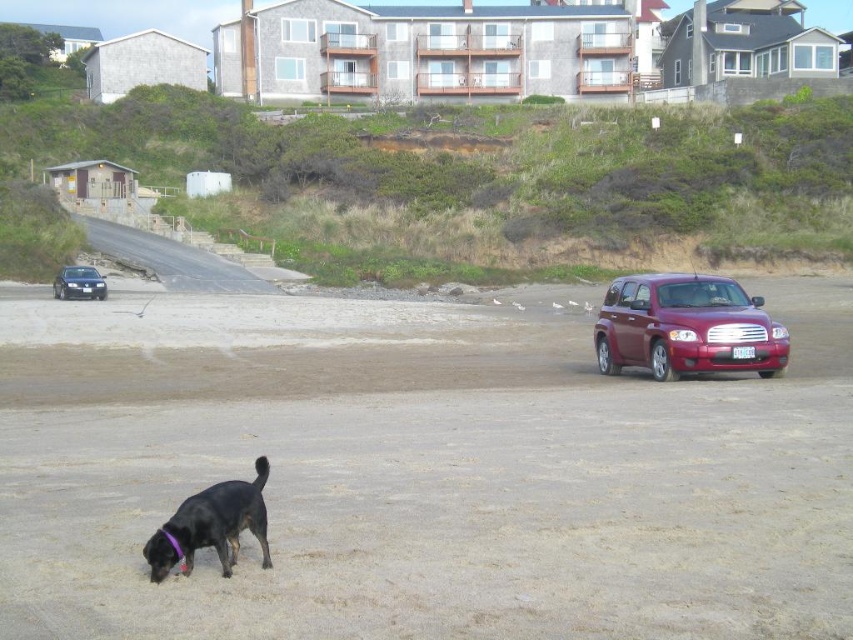
You are standing at the edge of the sandy beach at lower center and want to find the black fur dog at lower left. Which direction should you look to locate it?

The black fur dog at lower left is to the left of the sandy beach at lower center, so you should look to the left to find it.

You are a photographer trying to capture a photo of the black fur dog at lower left without the shiny maroon suv at right appearing in the background. Given their relative heights, is it possible to angle your camera so that the suv is obscured by something else in the scene?

The shiny maroon suv at right is taller than the black fur dog at lower left. Since the suv is taller, it might be challenging to obscure it with objects like the grassy hillside or shrubs, which are likely lower than the suv. However, the buildings in the background are multi story and could potentially block the suv if positioned correctly.

You are standing at the center of the dirt road in the midground. You want to find the black fur dog at lower left. Which direction should you look to locate it?

The black fur dog at lower left is located at point (212,525), which would be to your lower left direction from the center of the dirt road in the midground.